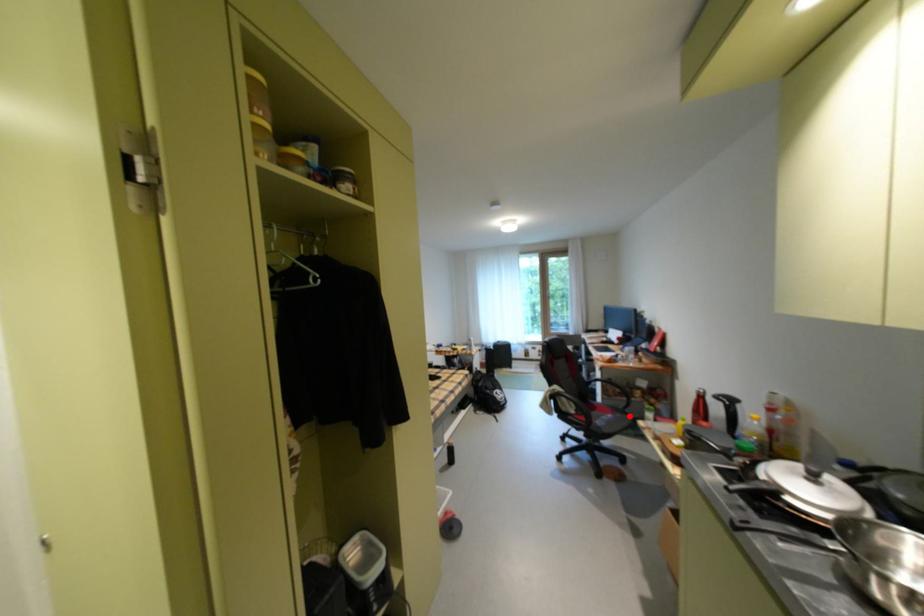
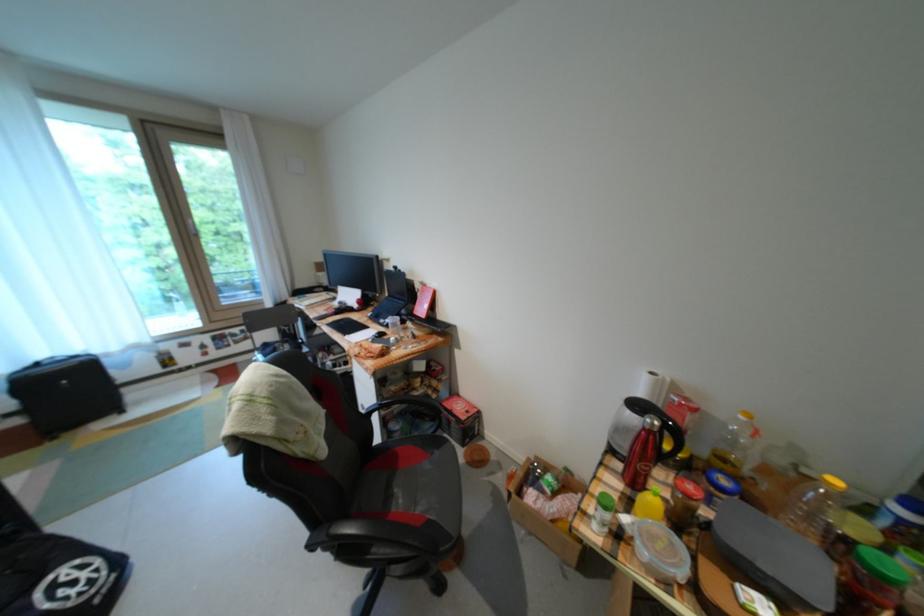
Question: I am providing you with two images of the same scene from different viewpoints. Image1 has a red point marked. In image2, the corresponding 3D location appears at what relative position? Reply with the corresponding letter.

Choices:
 (A) Closer
 (B) Farther

Answer: (A)